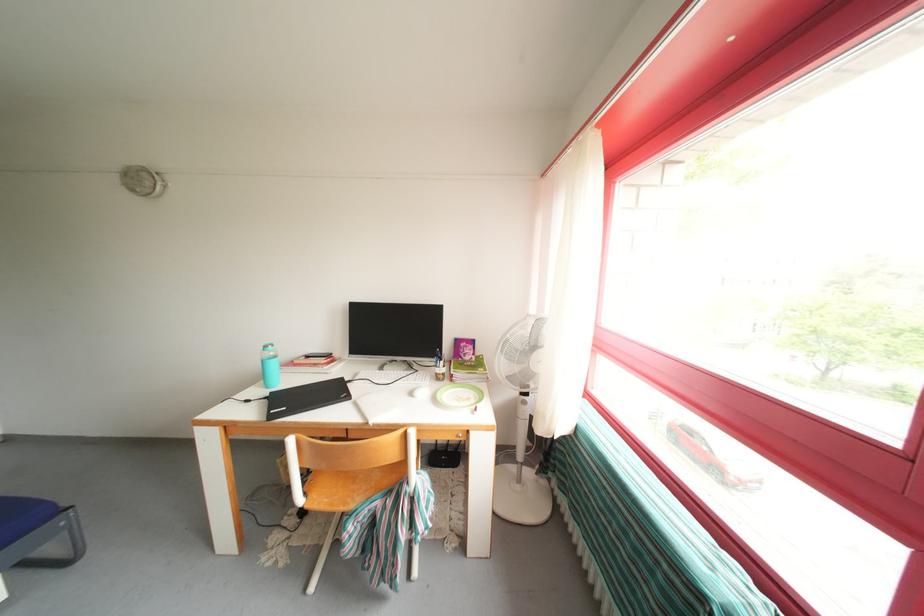
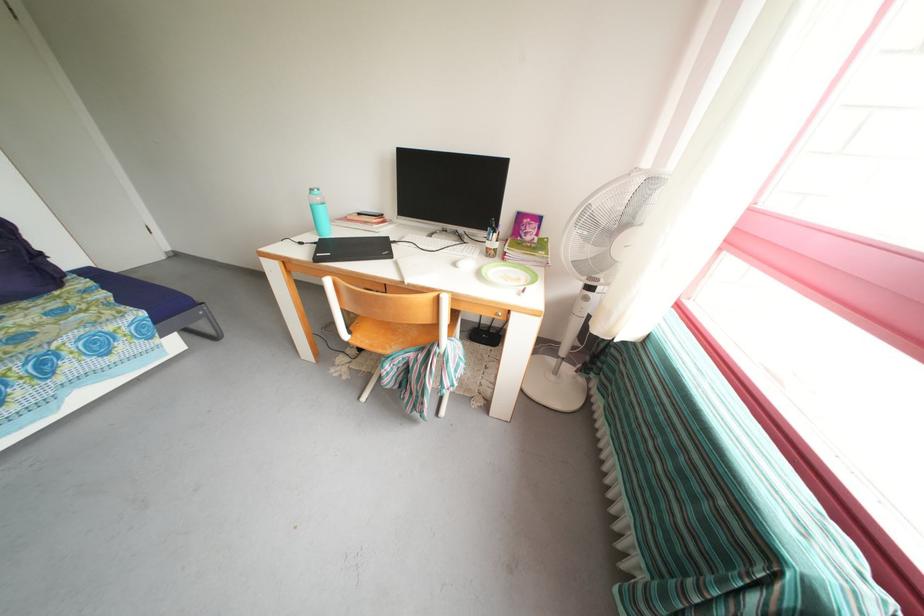
The point at (472, 360) is marked in the first image. Where is the corresponding point in the second image?

(532, 238)